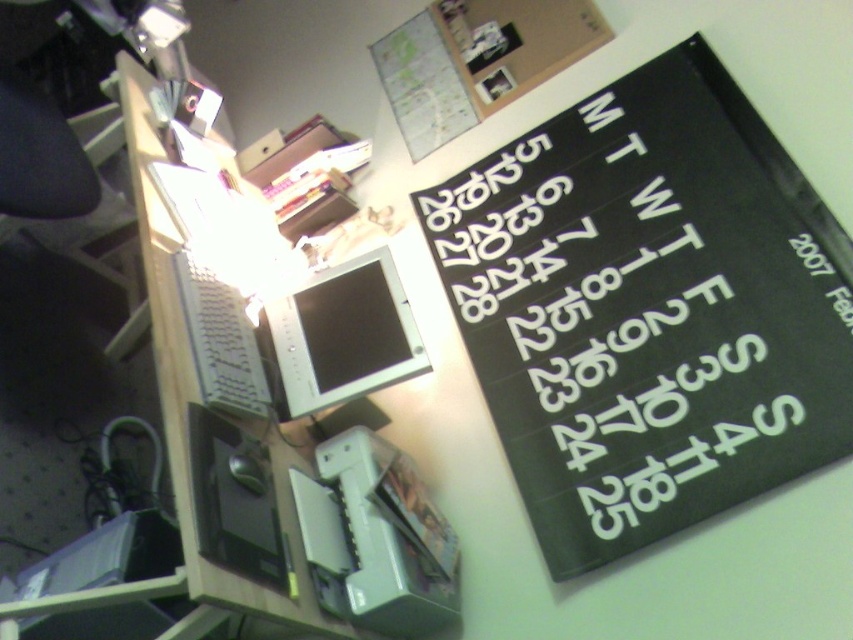
Between white plastic computer desk at center and matte silver monitor at center, which one is positioned lower?

Positioned lower is matte silver monitor at center.

Who is positioned more to the left, white plastic computer desk at center or matte silver monitor at center?

white plastic computer desk at center is more to the left.

Between point (229, 586) and point (323, 368), which one is positioned behind?

Point (323, 368)

Locate an element on the screen. The image size is (853, 640). white plastic computer desk at center is located at coordinates (267, 433).

Who is taller, matte silver monitor at center or satin silver keyboard at left?

matte silver monitor at center

Identify the location of matte silver monitor at center. Image resolution: width=853 pixels, height=640 pixels. (344, 336).

In the scene shown: Who is positioned more to the left, black paper calendar at upper right or matte silver monitor at center?

matte silver monitor at center

Can you confirm if black paper calendar at upper right is positioned to the right of matte silver monitor at center?

Indeed, black paper calendar at upper right is positioned on the right side of matte silver monitor at center.

Measure the distance between black paper calendar at upper right and camera.

The distance of black paper calendar at upper right from camera is 1.25 meters.

What are the coordinates of `black paper calendar at upper right` in the screenshot? It's located at (648, 308).